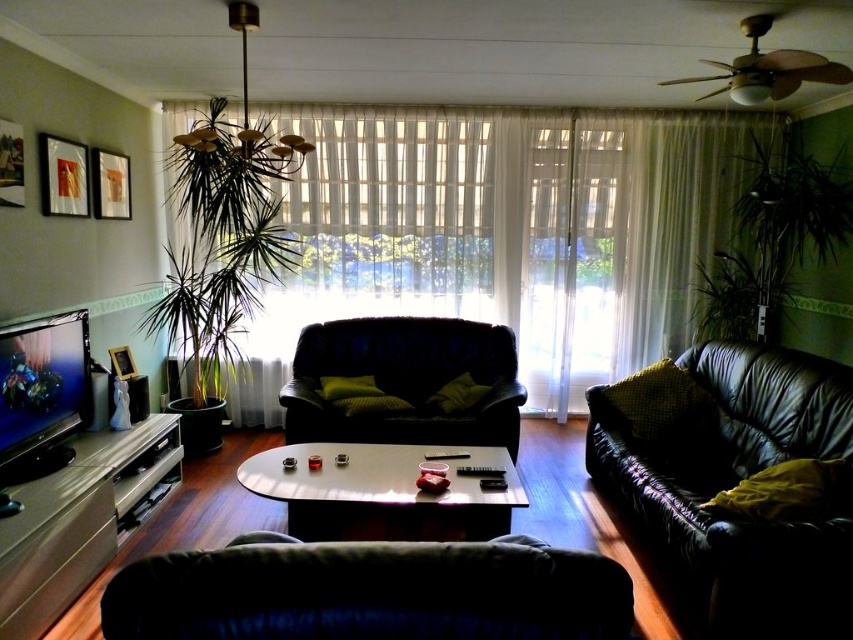
Can you confirm if white glossy coffee table at center is shorter than matte black picture frame at upper left?

In fact, white glossy coffee table at center may be taller than matte black picture frame at upper left.

Which of these two, white glossy coffee table at center or matte black picture frame at upper left, stands taller?

Standing taller between the two is white glossy coffee table at center.

Find the location of a particular element. This screenshot has height=640, width=853. white glossy coffee table at center is located at coordinates (381, 492).

Does green leafy plant at right appear on the left side of white glossy coffee table at center?

Incorrect, green leafy plant at right is not on the left side of white glossy coffee table at center.

Is green leafy plant at right further to the viewer compared to white glossy coffee table at center?

That is True.

Is point (762, 188) farther from camera compared to point (320, 470)?

Yes, it is behind point (320, 470).

This screenshot has height=640, width=853. Find the location of `green leafy plant at right`. green leafy plant at right is located at coordinates (775, 236).

Which is more to the left, sheer white curtain at center or matte gold picture frame at left?

Positioned to the left is matte gold picture frame at left.

Is sheer white curtain at center above matte gold picture frame at left?

Yes, sheer white curtain at center is above matte gold picture frame at left.

At what (x,y) coordinates should I click in order to perform the action: click on sheer white curtain at center. Please return your answer as a coordinate pair (x, y). Looking at the image, I should click on (503, 234).

This screenshot has width=853, height=640. Identify the location of sheer white curtain at center. (503, 234).